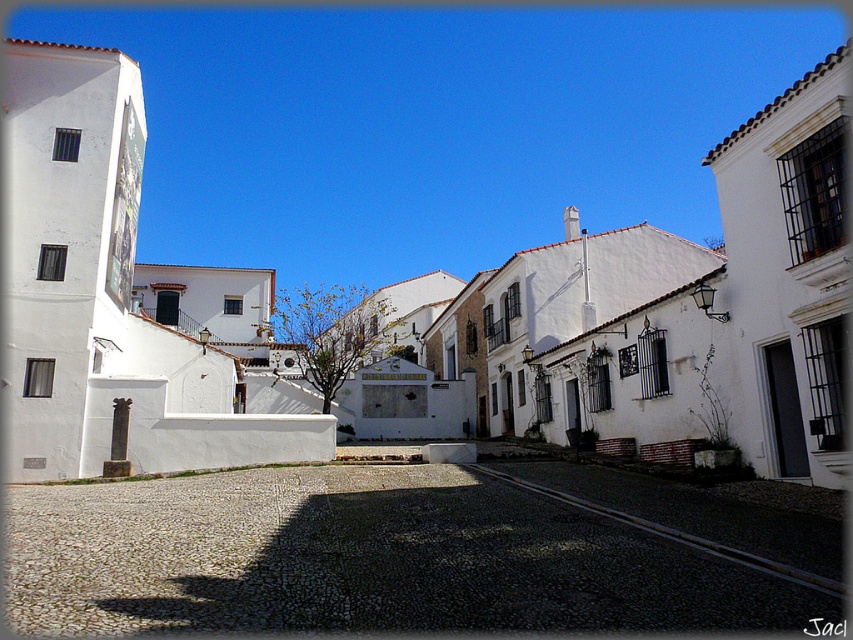
Which is more to the left, gray cobblestone alley at center or white matte building at center?

gray cobblestone alley at center

Between gray cobblestone alley at center and white matte building at center, which one is positioned lower?

Positioned lower is gray cobblestone alley at center.

I want to click on gray cobblestone alley at center, so [360, 560].